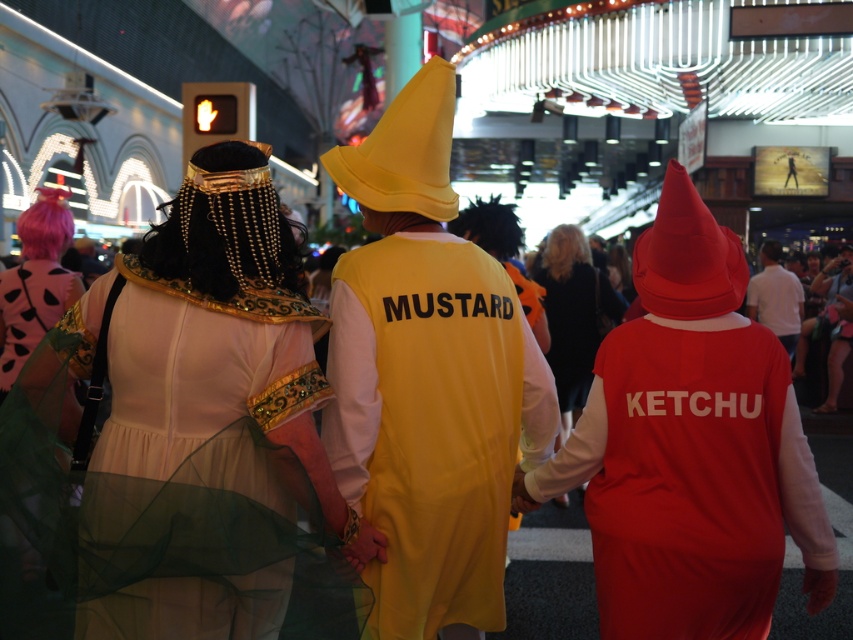
Does matte gold dress at center have a greater width compared to white cotton shirt at upper right?

Correct, the width of matte gold dress at center exceeds that of white cotton shirt at upper right.

Does matte gold dress at center have a greater height compared to white cotton shirt at upper right?

No, matte gold dress at center is not taller than white cotton shirt at upper right.

Who is more forward, (161, 465) or (759, 316)?

Point (161, 465)

Where is `matte gold dress at center`? The image size is (853, 640). matte gold dress at center is located at coordinates (207, 385).

Is point (457, 307) positioned in front of point (769, 244)?

Yes.

Which is in front, point (442, 316) or point (746, 296)?

Point (442, 316) is more forward.

Does point (421, 436) lie behind point (802, 314)?

No, (421, 436) is in front of (802, 314).

What are the coordinates of `yellow matte dress at center` in the screenshot? It's located at (427, 378).

Can you confirm if yellow matte dress at center is shorter than matte red costume at right?

No, yellow matte dress at center is not shorter than matte red costume at right.

The image size is (853, 640). I want to click on yellow matte dress at center, so click(427, 378).

Identify the location of yellow matte dress at center. The height and width of the screenshot is (640, 853). (427, 378).